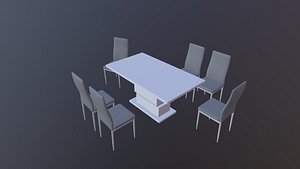
Where is `chair seat`? Image resolution: width=300 pixels, height=169 pixels. chair seat is located at coordinates (120, 110).